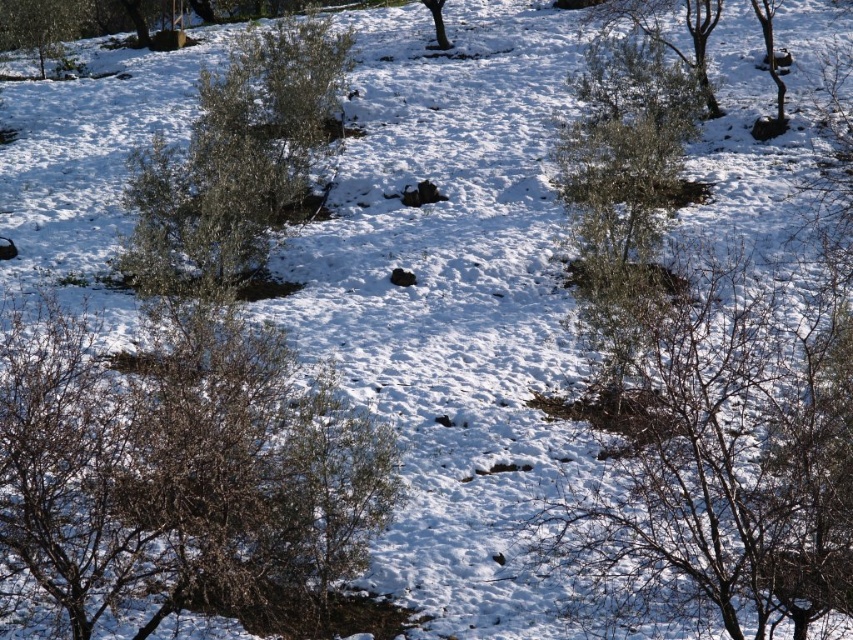
What do you see at coordinates (625, 188) in the screenshot?
I see `green leafy shrub at center` at bounding box center [625, 188].

Between green leafy shrub at center and bare branches at upper right, which one appears on the right side from the viewer's perspective?

bare branches at upper right

Describe the element at coordinates (625, 188) in the screenshot. I see `green leafy shrub at center` at that location.

The height and width of the screenshot is (640, 853). I want to click on green leafy shrub at center, so click(625, 188).

Measure the distance from green leafy shrub at upper right to green leafy tree at center.

7.30 meters

Based on the photo, how distant is green leafy shrub at upper right from green leafy tree at center?

green leafy shrub at upper right and green leafy tree at center are 23.94 feet apart from each other.

Which is in front, point (711, 28) or point (436, 24)?

Point (711, 28)

Identify the location of green leafy shrub at upper right. The image size is (853, 640). (666, 33).

Between bare branches at center and green leafy tree at center, which one is positioned lower?

bare branches at center is below.

Does point (779, 314) come in front of point (422, 1)?

Yes, point (779, 314) is closer to viewer.

Does point (572, 547) lie behind point (444, 1)?

No, (572, 547) is in front of (444, 1).

Image resolution: width=853 pixels, height=640 pixels. I want to click on bare branches at center, so click(x=721, y=460).